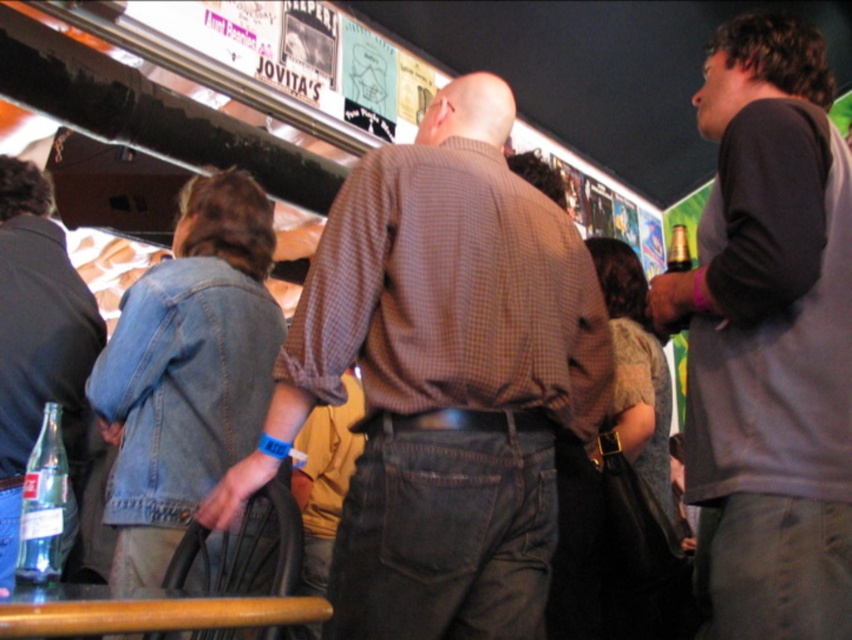
You are at a social event and want to approach the man in the brown checkered shirt. You see the gray sweatshirt at upper right and the denim jacket at lower left. Which object is closer to your current position?

The denim jacket at lower left is behind the gray sweatshirt at upper right, so the gray sweatshirt at upper right is closer to your current position.

You are at a social event and want to know if the brown checkered shirt at center can fit into a coat rack designed for garments wider than the gray sweatshirt at upper right. Can it fit?

The brown checkered shirt at center is wider than the gray sweatshirt at upper right, so it can fit into the coat rack designed for garments wider than the gray sweatshirt at upper right.